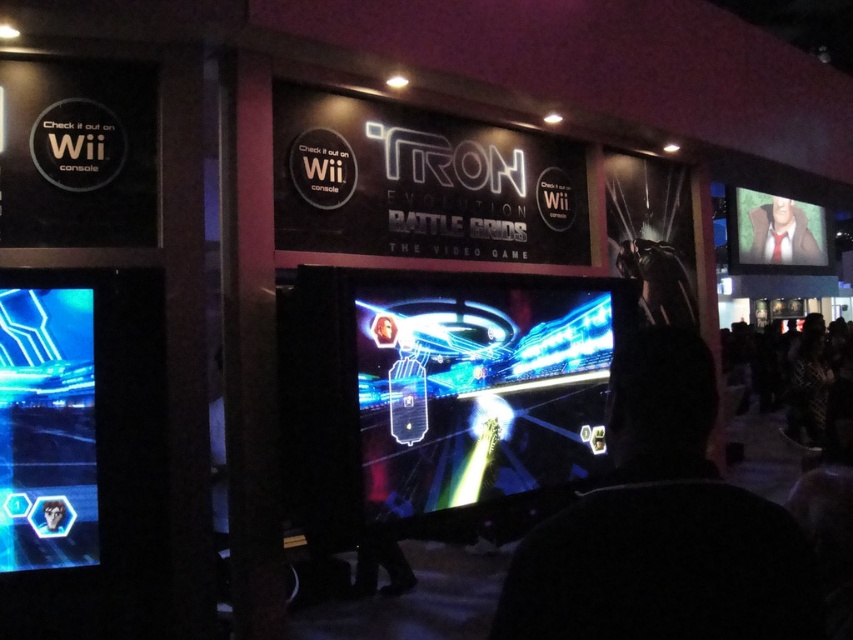
Is black fabric at center above glossy plastic screen at lower left?

Yes, black fabric at center is above glossy plastic screen at lower left.

In the scene shown: Is black fabric at center below glossy plastic screen at lower left?

No, black fabric at center is not below glossy plastic screen at lower left.

Find the location of a particular element. The width and height of the screenshot is (853, 640). black fabric at center is located at coordinates (662, 528).

The image size is (853, 640). I want to click on black fabric at center, so click(x=662, y=528).

Can you confirm if glossy plastic screen at lower left is taller than smooth tan suit at upper right?

No.

Can you confirm if glossy plastic screen at lower left is wider than smooth tan suit at upper right?

No, glossy plastic screen at lower left is not wider than smooth tan suit at upper right.

Who is more forward, (1, 524) or (753, 260)?

Positioned in front is point (1, 524).

This screenshot has height=640, width=853. I want to click on glossy plastic screen at lower left, so click(x=45, y=429).

Can you confirm if black fabric at center is wider than smooth tan suit at upper right?

No.

Does black fabric at center lie in front of smooth tan suit at upper right?

Yes, black fabric at center is in front of smooth tan suit at upper right.

Who is more distant from viewer, [625,592] or [782,252]?

Point [782,252]

At what (x,y) coordinates should I click in order to perform the action: click on black fabric at center. Please return your answer as a coordinate pair (x, y). This screenshot has height=640, width=853. Looking at the image, I should click on (662, 528).